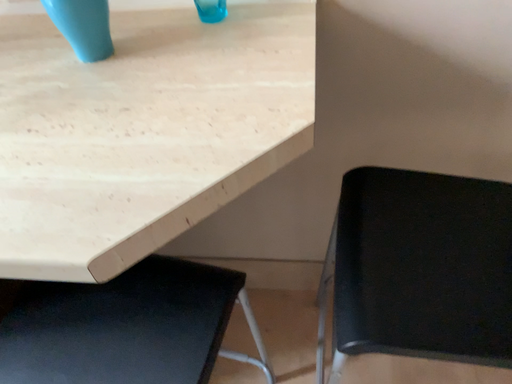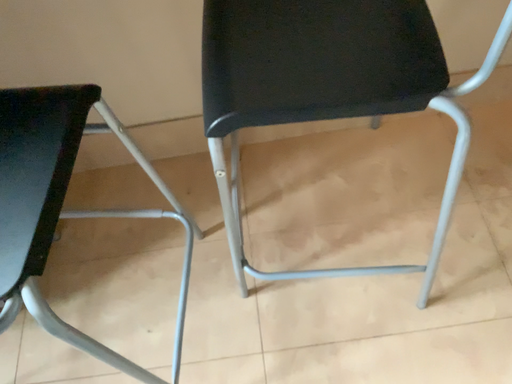
Question: Which way did the camera rotate in the video?

Choices:
 (A) rotated downward
 (B) rotated upward

Answer: (A)